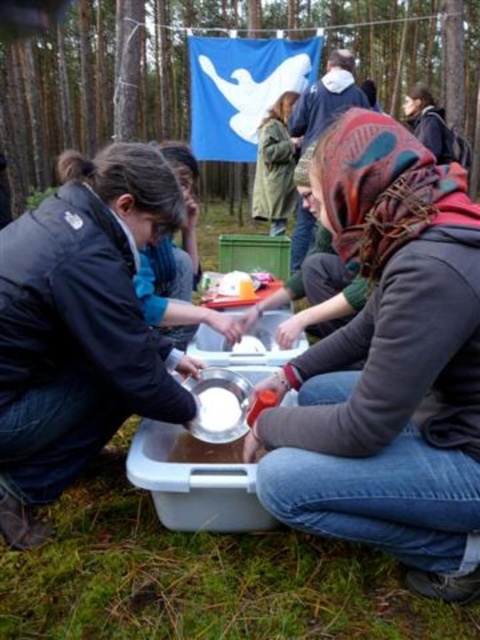
Does matte black jacket at lower left appear on the right side of white matte bowl at center?

In fact, matte black jacket at lower left is to the left of white matte bowl at center.

Is matte black jacket at lower left positioned in front of white matte bowl at center?

Yes, matte black jacket at lower left is closer to the viewer.

Who is more distant from viewer, (x=93, y=292) or (x=204, y=392)?

The point (x=204, y=392) is behind.

Find the location of `matte black jacket at lower left`. matte black jacket at lower left is located at coordinates (81, 326).

Is green matte jacket at center bigger than white matte bowl at center?

Yes.

Is green matte jacket at center above white matte bowl at center?

Correct, green matte jacket at center is located above white matte bowl at center.

Is point (264, 211) positioned behind point (216, 420)?

That is True.

Identify the location of green matte jacket at center. The width and height of the screenshot is (480, 640). (275, 166).

Who is positioned more to the left, matte gray hoodie at center or green matte jacket at center?

Positioned to the left is green matte jacket at center.

Is point (308, 362) positioned in front of point (283, 220)?

That is True.

The image size is (480, 640). Find the location of `matte gray hoodie at center`. matte gray hoodie at center is located at coordinates (388, 365).